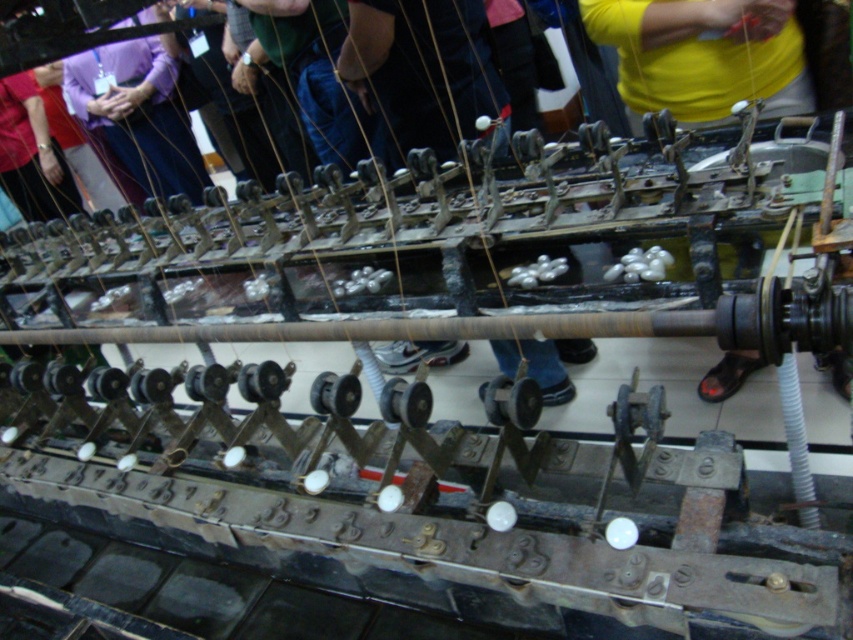
Question: Which of these objects is positioned closest to the yellow cotton shirt at upper center?

Choices:
 (A) yellow fabric at center
 (B) denim jeans at center

Answer: (B)

Question: Does yellow fabric at center have a lesser width compared to denim jeans at center?

Choices:
 (A) no
 (B) yes

Answer: (A)

Question: Estimate the real-world distances between objects in this image. Which object is closer to the yellow fabric at center?

Choices:
 (A) yellow cotton shirt at upper center
 (B) denim jeans at center

Answer: (A)

Question: Is yellow cotton shirt at upper center above yellow fabric at center?

Choices:
 (A) yes
 (B) no

Answer: (B)

Question: Which object is farther from the camera taking this photo?

Choices:
 (A) denim jeans at center
 (B) yellow fabric at center
 (C) yellow cotton shirt at upper center

Answer: (A)

Question: Is yellow fabric at center smaller than denim jeans at center?

Choices:
 (A) yes
 (B) no

Answer: (A)